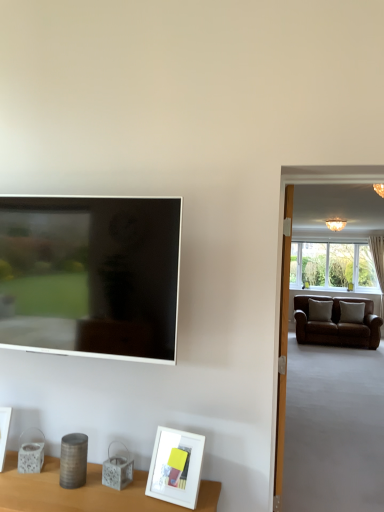
How much space does white matte picture frame at lower center, placed as the first picture frame when sorted from right to left, occupy vertically?

The height of white matte picture frame at lower center, placed as the first picture frame when sorted from right to left, is 27.19 centimeters.

Image resolution: width=384 pixels, height=512 pixels. Describe the element at coordinates (176, 467) in the screenshot. I see `white matte picture frame at lower center, acting as the second picture frame starting from the back` at that location.

I want to click on white matte picture frame at lower left, the first picture frame in the left-to-right sequence, so click(x=4, y=432).

What do you see at coordinates (4, 432) in the screenshot?
I see `white matte picture frame at lower left, the 1th picture frame viewed from the back` at bounding box center [4, 432].

You are a GUI agent. You are given a task and a screenshot of the screen. Output one action in this format:
    pyautogui.click(x=<x>, y=<y>)
    Task: Click on the white matte picture frame at lower center, placed as the first picture frame when sorted from right to left
    The height and width of the screenshot is (512, 384).
    Given the screenshot: What is the action you would take?
    click(176, 467)

Considering the positions of objects white matte picture frame at lower left, the 2th picture frame when ordered from front to back, and matte black tv at left in the image provided, who is more to the left, white matte picture frame at lower left, the 2th picture frame when ordered from front to back, or matte black tv at left?

Positioned to the left is white matte picture frame at lower left, the 2th picture frame when ordered from front to back.

Can matte black tv at left be found inside white matte picture frame at lower left, the 1th picture frame viewed from the back?

Actually, matte black tv at left is outside white matte picture frame at lower left, the 1th picture frame viewed from the back.

The image size is (384, 512). What are the coordinates of `picture frame behind the matte black tv at left` in the screenshot? It's located at (4, 432).

Which is behind, white matte picture frame at lower left, the 2th picture frame when ordered from front to back, or matte black tv at left?

white matte picture frame at lower left, the 2th picture frame when ordered from front to back, is behind.

Considering the relative sizes of white matte picture frame at lower center, acting as the 2th picture frame starting from the left, and white matte picture frame at lower left, the 2th picture frame when ordered from front to back, in the image provided, is white matte picture frame at lower center, acting as the 2th picture frame starting from the left, taller than white matte picture frame at lower left, the 2th picture frame when ordered from front to back,?

Indeed, white matte picture frame at lower center, acting as the 2th picture frame starting from the left, has a greater height compared to white matte picture frame at lower left, the 2th picture frame when ordered from front to back.

Could you tell me if white matte picture frame at lower center, placed as the first picture frame when sorted from right to left, is turned towards white matte picture frame at lower left, the first picture frame in the left-to-right sequence?

No, white matte picture frame at lower center, placed as the first picture frame when sorted from right to left, does not turn towards white matte picture frame at lower left, the first picture frame in the left-to-right sequence.

Can you confirm if white matte picture frame at lower center, placed as the first picture frame when sorted from right to left, is wider than white matte picture frame at lower left, the first picture frame in the left-to-right sequence?

Yes, white matte picture frame at lower center, placed as the first picture frame when sorted from right to left, is wider than white matte picture frame at lower left, the first picture frame in the left-to-right sequence.

From the image's perspective, is white matte picture frame at lower center, placed as the first picture frame when sorted from right to left, located above or below white matte picture frame at lower left, the first picture frame in the left-to-right sequence?

white matte picture frame at lower center, placed as the first picture frame when sorted from right to left, is below white matte picture frame at lower left, the first picture frame in the left-to-right sequence.

Is white matte picture frame at lower left, the first picture frame in the left-to-right sequence, outside of white matte picture frame at lower center, acting as the 2th picture frame starting from the left?

Yes, white matte picture frame at lower left, the first picture frame in the left-to-right sequence, is not within white matte picture frame at lower center, acting as the 2th picture frame starting from the left.

From the image's perspective, is white matte picture frame at lower left, which appears as the 2th picture frame when viewed from the right, on white matte picture frame at lower center, placed as the first picture frame when sorted from right to left?

Indeed, from the image's perspective, white matte picture frame at lower left, which appears as the 2th picture frame when viewed from the right, is shown above white matte picture frame at lower center, placed as the first picture frame when sorted from right to left.

Is the surface of white matte picture frame at lower left, the 1th picture frame viewed from the back, in direct contact with white matte picture frame at lower center, placed as the first picture frame when sorted from right to left?

There is a gap between white matte picture frame at lower left, the 1th picture frame viewed from the back, and white matte picture frame at lower center, placed as the first picture frame when sorted from right to left.

Find the location of a particular element. Image resolution: width=384 pixels, height=512 pixels. picture frame on the right of white matte picture frame at lower left, the first picture frame in the left-to-right sequence is located at coordinates (176, 467).

Which is behind, point (108, 236) or point (5, 446)?

The point (5, 446) is behind.

Find the location of a particular element. television above the white matte picture frame at lower left, the 1th picture frame viewed from the back (from the image's perspective) is located at coordinates (90, 276).

Is the position of matte black tv at left more distant than that of white matte picture frame at lower left, the first picture frame in the left-to-right sequence?

No, it is in front of white matte picture frame at lower left, the first picture frame in the left-to-right sequence.

Considering the relative sizes of matte black tv at left and white matte picture frame at lower left, the 1th picture frame viewed from the back, in the image provided, is matte black tv at left shorter than white matte picture frame at lower left, the 1th picture frame viewed from the back,?

In fact, matte black tv at left may be taller than white matte picture frame at lower left, the 1th picture frame viewed from the back.

From the image's perspective, which one is positioned higher, matte black tv at left or white matte picture frame at lower center, acting as the second picture frame starting from the back?

matte black tv at left is shown above in the image.

Is point (0, 283) more distant than point (155, 464)?

Yes, it is behind point (155, 464).

Is matte black tv at left surrounding white matte picture frame at lower center, which ranks as the 1th picture frame in front-to-back order?

Actually, white matte picture frame at lower center, which ranks as the 1th picture frame in front-to-back order, is outside matte black tv at left.

Who is more distant, matte black tv at left or white matte picture frame at lower center, acting as the 2th picture frame starting from the left?

matte black tv at left is behind.

Is point (156, 482) closer to camera compared to point (108, 213)?

Yes, it is in front of point (108, 213).

Is white matte picture frame at lower center, acting as the second picture frame starting from the back, at the right side of matte black tv at left?

Indeed, white matte picture frame at lower center, acting as the second picture frame starting from the back, is positioned on the right side of matte black tv at left.

The height and width of the screenshot is (512, 384). In the image, there is a white matte picture frame at lower center, placed as the first picture frame when sorted from right to left. Find the location of `television above it (from the image's perspective)`. television above it (from the image's perspective) is located at coordinates (90, 276).

How different are the orientations of white matte picture frame at lower center, acting as the 2th picture frame starting from the left, and matte black tv at left in degrees?

They differ by 9.36 degrees in their facing directions.

You are a GUI agent. You are given a task and a screenshot of the screen. Output one action in this format:
    pyautogui.click(x=<x>, y=<y>)
    Task: Click on the television above the white matte picture frame at lower left, the 1th picture frame viewed from the back (from a real-world perspective)
    
    Given the screenshot: What is the action you would take?
    pyautogui.click(x=90, y=276)

Identify the location of picture frame behind the white matte picture frame at lower center, which ranks as the 1th picture frame in front-to-back order. Image resolution: width=384 pixels, height=512 pixels. (4, 432).

From the image, which object appears to be farther from matte black tv at left, white matte picture frame at lower left, the 2th picture frame when ordered from front to back, or white matte picture frame at lower center, acting as the 2th picture frame starting from the left?

white matte picture frame at lower left, the 2th picture frame when ordered from front to back, is positioned further to the anchor matte black tv at left.

Estimate the real-world distances between objects in this image. Which object is closer to white matte picture frame at lower center, acting as the 2th picture frame starting from the left, matte black tv at left or white matte picture frame at lower left, the 1th picture frame viewed from the back?

matte black tv at left is closer to white matte picture frame at lower center, acting as the 2th picture frame starting from the left.

Looking at the image, which one is located further to white matte picture frame at lower left, which appears as the 2th picture frame when viewed from the right, white matte picture frame at lower center, acting as the second picture frame starting from the back, or matte black tv at left?

white matte picture frame at lower center, acting as the second picture frame starting from the back, lies further to white matte picture frame at lower left, which appears as the 2th picture frame when viewed from the right, than the other object.

When comparing their distances from matte black tv at left, does white matte picture frame at lower center, acting as the 2th picture frame starting from the left, or white matte picture frame at lower left, the 2th picture frame when ordered from front to back, seem closer?

white matte picture frame at lower center, acting as the 2th picture frame starting from the left, lies closer to matte black tv at left than the other object.

Estimate the real-world distances between objects in this image. Which object is closer to white matte picture frame at lower left, the 2th picture frame when ordered from front to back, matte black tv at left or white matte picture frame at lower center, placed as the first picture frame when sorted from right to left?

matte black tv at left.

Considering their positions, is white matte picture frame at lower left, the 2th picture frame when ordered from front to back, positioned closer to white matte picture frame at lower center, which ranks as the 1th picture frame in front-to-back order, than matte black tv at left?

Based on the image, matte black tv at left appears to be nearer to white matte picture frame at lower center, which ranks as the 1th picture frame in front-to-back order.

You are a GUI agent. You are given a task and a screenshot of the screen. Output one action in this format:
    pyautogui.click(x=<x>, y=<y>)
    Task: Click on the television situated between white matte picture frame at lower left, the 2th picture frame when ordered from front to back, and white matte picture frame at lower center, placed as the first picture frame when sorted from right to left, from left to right
    
    Given the screenshot: What is the action you would take?
    pyautogui.click(x=90, y=276)